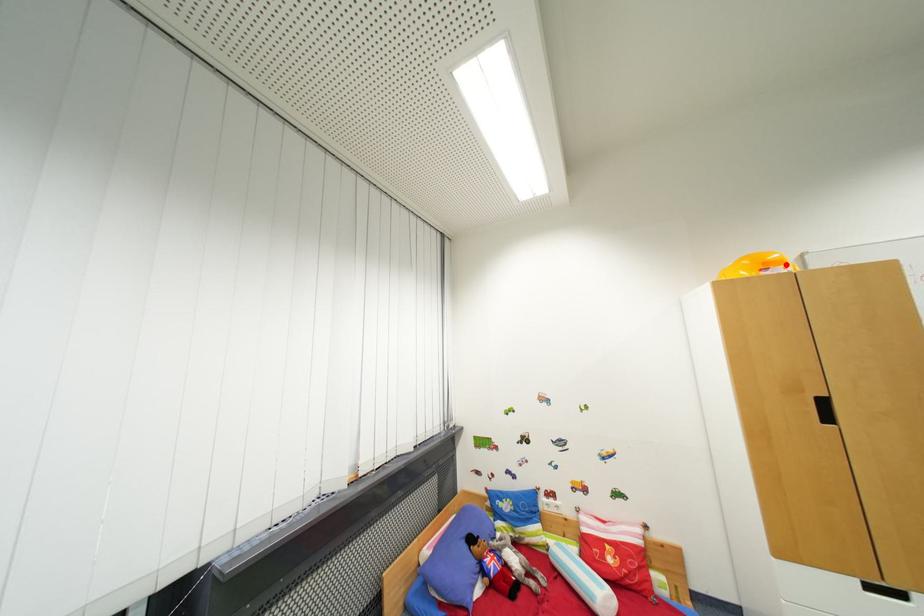
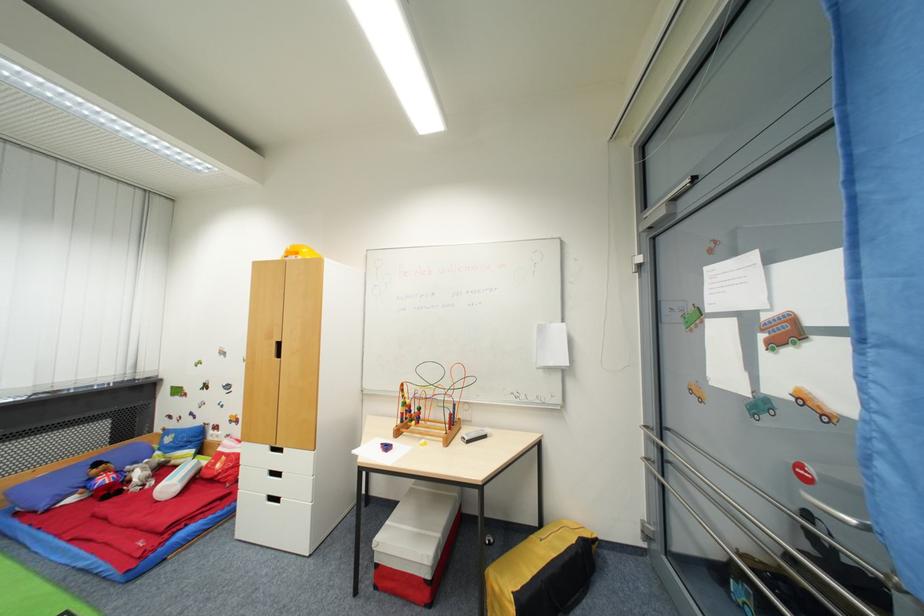
Question: I am providing you with two images of the same scene from different viewpoints. A red point is marked on the first image. Is the red point's position out of view in image 2?

Choices:
 (A) Yes
 (B) No

Answer: (A)